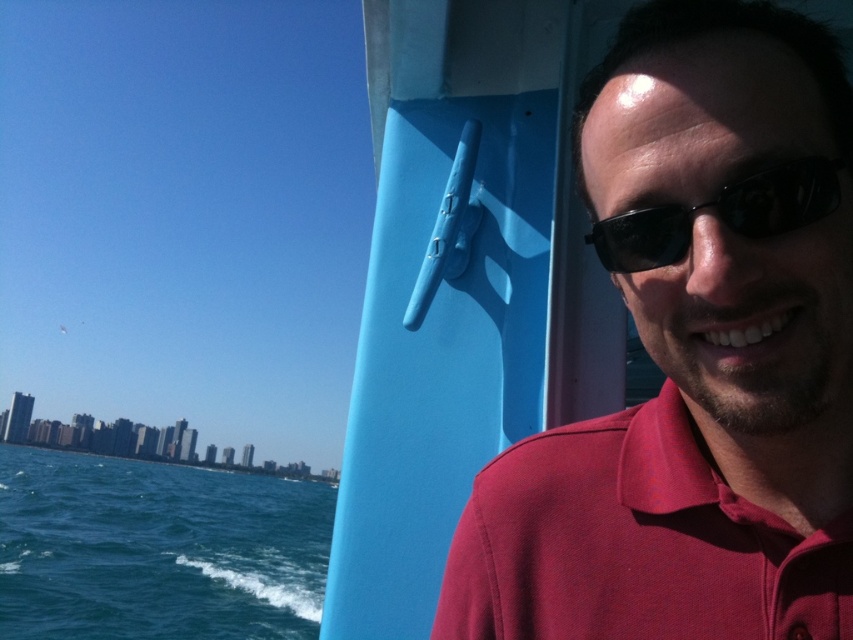
Consider the image. You are a photographer trying to capture both the matte red shirt at right and the matte red polo shirt at right in the same frame. Which one is closer to the camera?

The matte red shirt at right is in front of the matte red polo shirt at right, so the matte red shirt at right is closer to the camera.